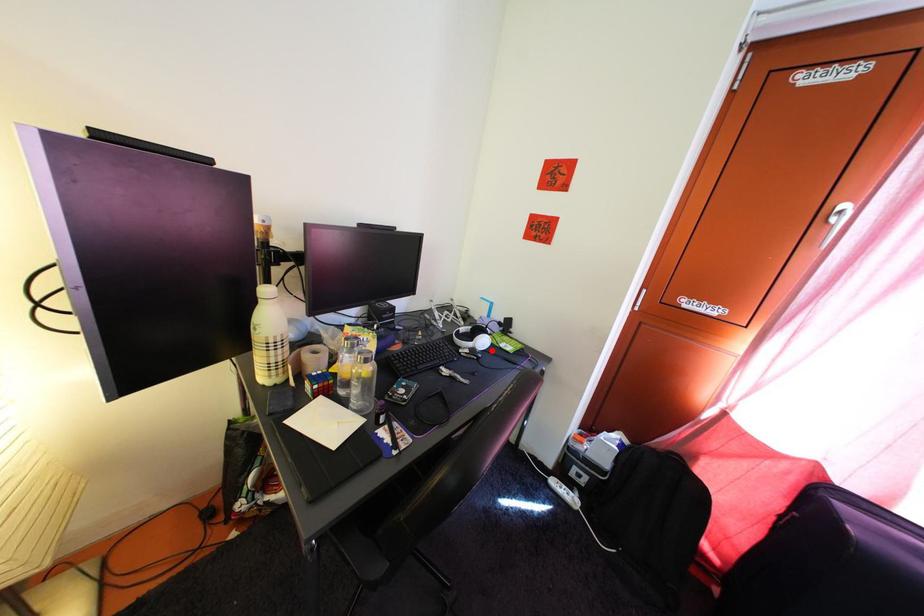
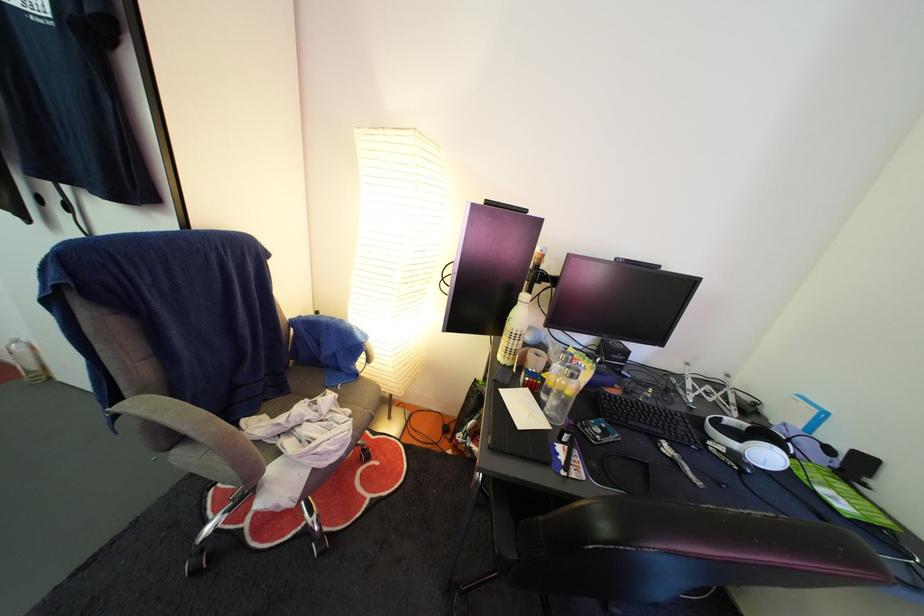
In the second image, find the point that corresponds to the highlighted location in the first image.

(774, 464)